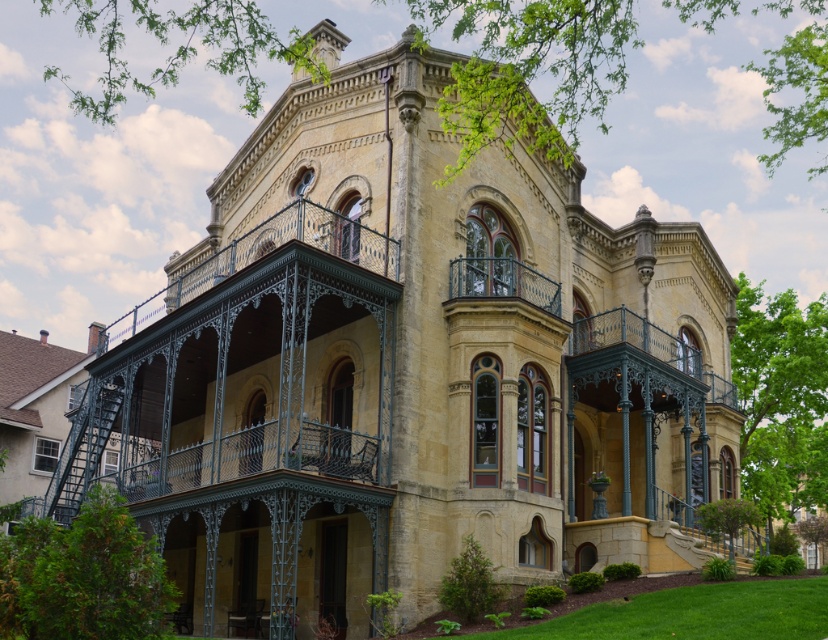
You are standing in front of a grand Victorian house and want to take a photo of the point at coordinates point [644,317]. If your camera can focus on objects within 100 meters, will it be able to capture the point clearly?

The distance of point [644,317] from camera is 77.49 meters, which is within the camera focus range of 100 meters. Therefore, the camera can capture the point clearly.